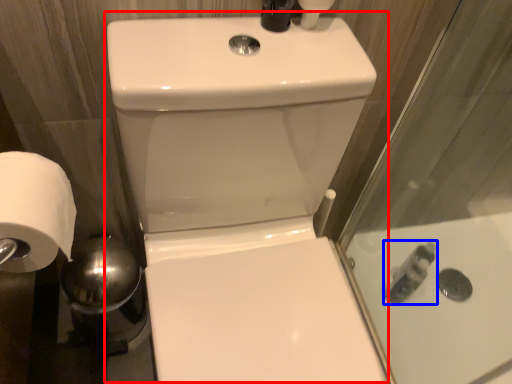
Question: Which object is further to the camera taking this photo, sink (highlighted by a red box) or toiletry (highlighted by a blue box)?

Choices:
 (A) sink
 (B) toiletry

Answer: (B)